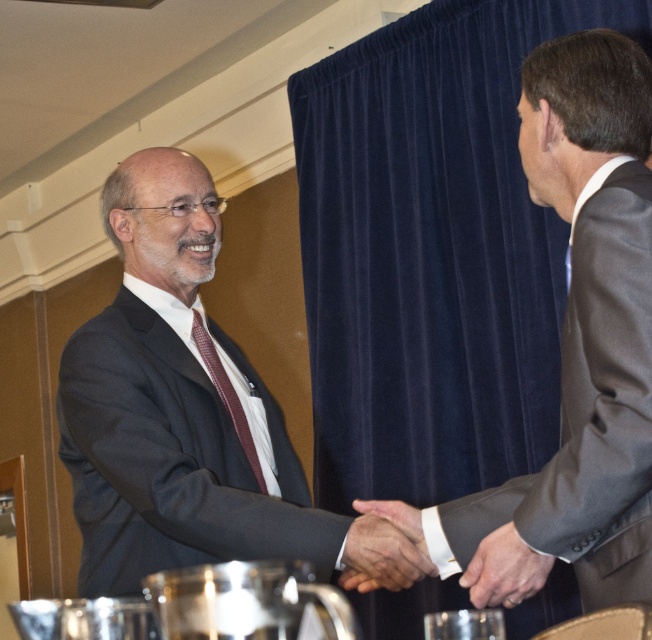
You are a GUI agent. You are given a task and a screenshot of the screen. Output one action in this format:
    pyautogui.click(x=<x>, y=<y>)
    Task: Click on the smooth leather hand at center
    
    Given the screenshot: What is the action you would take?
    pyautogui.click(x=383, y=547)

Is point (417, 512) behind point (256, 481)?

No, it is in front of (256, 481).

Where is `smooth leather hand at center`? The height and width of the screenshot is (640, 652). smooth leather hand at center is located at coordinates click(x=383, y=547).

Can you confirm if matte black suit at center is wider than gray pinstripe suit at right?

Yes.

The width and height of the screenshot is (652, 640). Identify the location of matte black suit at center. pos(173,404).

Is gray pinstripe suit at right taller than white leather hand at center?

Yes.

This screenshot has height=640, width=652. What do you see at coordinates (591, 412) in the screenshot? I see `gray pinstripe suit at right` at bounding box center [591, 412].

Who is more distant from viewer, [574,570] or [492,598]?

Point [574,570]

Identify the location of gray pinstripe suit at right. This screenshot has height=640, width=652. (591, 412).